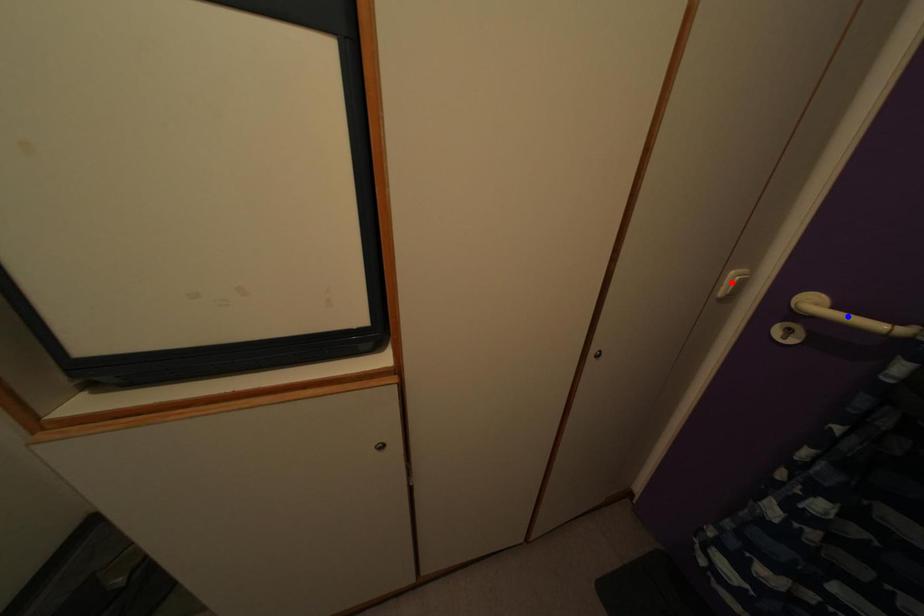
Question: Two points are marked on the image. Which point is closer to the camera?

Choices:
 (A) Blue point is closer.
 (B) Red point is closer.

Answer: (A)